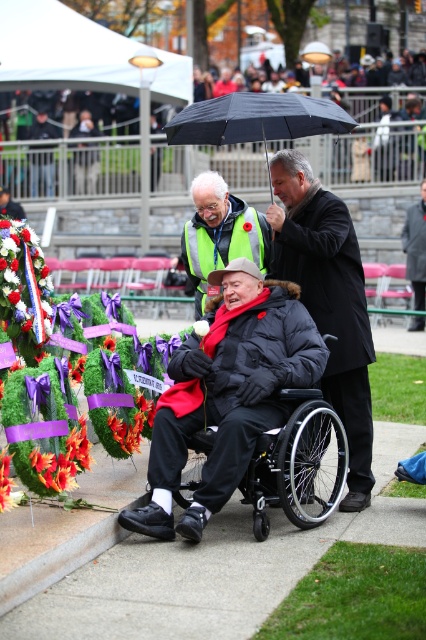
Question: Is orange fabric flower at lower left closer to the viewer compared to white fabric flower at center?

Choices:
 (A) yes
 (B) no

Answer: (A)

Question: Among these points, which one is farthest from the camera?

Choices:
 (A) (46, 476)
 (B) (236, 212)
 (C) (330, 364)
 (D) (287, 429)

Answer: (B)

Question: Can you confirm if black plastic wheelchair at center is positioned above dark gray coat at center?

Choices:
 (A) yes
 (B) no

Answer: (B)

Question: Does reflective silver vest at center appear under dark gray coat at center?

Choices:
 (A) no
 (B) yes

Answer: (B)

Question: Which of the following is the farthest from the observer?

Choices:
 (A) (11, 492)
 (B) (178, 120)
 (C) (317, 216)

Answer: (B)

Question: Which object appears farthest from the camera in this image?

Choices:
 (A) orange fabric flower at lower left
 (B) reflective silver vest at center

Answer: (B)